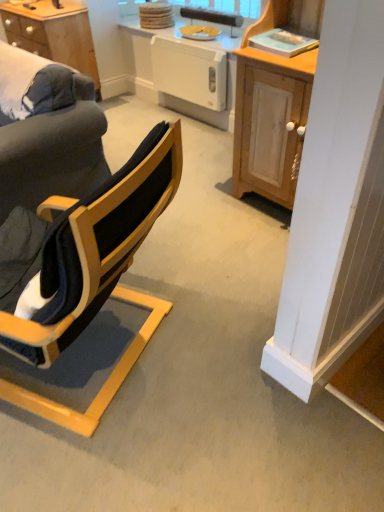
Measure the distance between light wood cabinet at right and camera.

light wood cabinet at right is 1.85 meters away from camera.

Where is `yellow matte plate at upper center`? This screenshot has width=384, height=512. yellow matte plate at upper center is located at coordinates (199, 32).

Is yellow matte plate at upper center looking in the opposite direction of matte black chair at left?

No, yellow matte plate at upper center's orientation is not away from matte black chair at left.

Does yellow matte plate at upper center have a greater height compared to matte black chair at left?

No.

Visually, is yellow matte plate at upper center positioned to the left or to the right of matte black chair at left?

Clearly, yellow matte plate at upper center is on the right of matte black chair at left in the image.

Is point (198, 31) closer to viewer compared to point (85, 426)?

No, (198, 31) is behind (85, 426).

Is white glossy radiator at center oriented away from yellow matte plate at upper center?

Absolutely, white glossy radiator at center is directed away from yellow matte plate at upper center.

Are white glossy radiator at center and yellow matte plate at upper center far apart?

No, white glossy radiator at center is in close proximity to yellow matte plate at upper center.

There is a white glossy radiator at center. Identify the location of plate above it (from a real-world perspective). This screenshot has height=512, width=384. (199, 32).

Which of these two, light wood cabinet at right or white glossy radiator at center, is wider?

Wider between the two is light wood cabinet at right.

From the image's perspective, is light wood cabinet at right above or below white glossy radiator at center?

light wood cabinet at right is below white glossy radiator at center.

Is light wood cabinet at right in front of or behind white glossy radiator at center in the image?

Visually, light wood cabinet at right is located in front of white glossy radiator at center.

Locate an element on the screen. The width and height of the screenshot is (384, 512). desk above the matte black chair at left (from the image's perspective) is located at coordinates (54, 35).

Can you confirm if wooden desk at upper left is positioned to the right of matte black chair at left?

Incorrect, wooden desk at upper left is not on the right side of matte black chair at left.

Looking at this image, from a real-world perspective, is wooden desk at upper left positioned above or below matte black chair at left?

In terms of real-world spatial position, wooden desk at upper left is below matte black chair at left.

Does white plastic dishwasher at center have a smaller size compared to yellow matte plate at upper center?

Actually, white plastic dishwasher at center might be larger than yellow matte plate at upper center.

From a real-world perspective, which is physically above, white plastic dishwasher at center or yellow matte plate at upper center?

yellow matte plate at upper center.

From the image's perspective, would you say white plastic dishwasher at center is positioned over yellow matte plate at upper center?

Actually, white plastic dishwasher at center appears below yellow matte plate at upper center in the image.

Which is more to the right, light wood cabinet at right or white plastic dishwasher at center?

From the viewer's perspective, light wood cabinet at right appears more on the right side.

Find the location of a particular element. dish washer that appears below the light wood cabinet at right (from a real-world perspective) is located at coordinates (190, 72).

Is light wood cabinet at right aimed at white plastic dishwasher at center?

No, light wood cabinet at right is not facing towards white plastic dishwasher at center.

In the scene shown: In the image, is white plastic dishwasher at center positioned in front of or behind light wood cabinet at right?

white plastic dishwasher at center is positioned farther from the viewer than light wood cabinet at right.

How many degrees apart are the facing directions of white plastic dishwasher at center and light wood cabinet at right?

white plastic dishwasher at center and light wood cabinet at right are facing 1.03 degrees away from each other.

Is point (211, 89) positioned behind point (257, 161)?

Yes, it is behind point (257, 161).

Is white plastic dishwasher at center positioned with its back to light wood cabinet at right?

white plastic dishwasher at center does not have its back to light wood cabinet at right.

In order to click on chair below the yellow matte plate at upper center (from a real-world perspective) in this screenshot , I will do `click(94, 272)`.

Image resolution: width=384 pixels, height=512 pixels. In order to click on plate above the white glossy radiator at center (from a real-world perspective) in this screenshot , I will do `click(199, 32)`.

Looking at the image, which one is located further to white glossy radiator at center, light wood cabinet at right or yellow matte plate at upper center?

light wood cabinet at right lies further to white glossy radiator at center than the other object.

Considering their positions, is matte black chair at left positioned further to yellow matte plate at upper center than white glossy radiator at center?

matte black chair at left is further to yellow matte plate at upper center.

Estimate the real-world distances between objects in this image. Which object is closer to wooden desk at upper left, yellow matte plate at upper center or light wood cabinet at right?

yellow matte plate at upper center lies closer to wooden desk at upper left than the other object.

From the image, which object appears to be farther from wooden desk at upper left, white plastic dishwasher at center or yellow matte plate at upper center?

Based on the image, yellow matte plate at upper center appears to be further to wooden desk at upper left.

When comparing their distances from white plastic dishwasher at center, does matte black chair at left or yellow matte plate at upper center seem further?

Among the two, matte black chair at left is located further to white plastic dishwasher at center.

Considering their positions, is white glossy radiator at center positioned further to light wood cabinet at right than wooden desk at upper left?

wooden desk at upper left.

Looking at the image, which one is located closer to white glossy radiator at center, white plastic dishwasher at center or wooden desk at upper left?

white plastic dishwasher at center is closer to white glossy radiator at center.

When comparing their distances from wooden desk at upper left, does white glossy radiator at center or white plastic dishwasher at center seem closer?

Based on the image, white glossy radiator at center appears to be nearer to wooden desk at upper left.

Where is `cabinetry between matte black chair at left and wooden desk at upper left in the front-back direction`? Image resolution: width=384 pixels, height=512 pixels. cabinetry between matte black chair at left and wooden desk at upper left in the front-back direction is located at coordinates (270, 110).

Locate an element on the screen. Image resolution: width=384 pixels, height=512 pixels. cabinetry between white glossy radiator at center and matte black chair at left vertically is located at coordinates (270, 110).

Locate an element on the screen. This screenshot has width=384, height=512. dish washer between white glossy radiator at center and yellow matte plate at upper center along the z-axis is located at coordinates (190, 72).

The image size is (384, 512). Identify the location of table located between light wood cabinet at right and white plastic dishwasher at center in the depth direction. (182, 71).